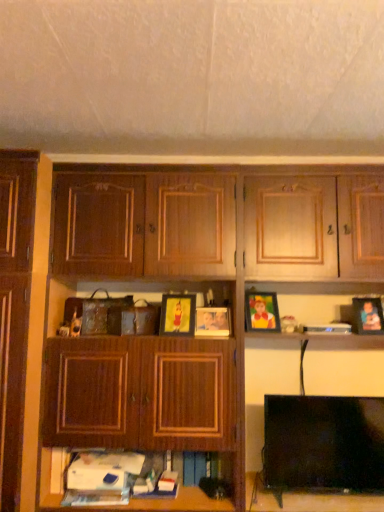
Question: Relative to matte plastic picture frame at center, which is counted as the 2th picture frame, starting from the right, is matte plastic picture frame at right, which is counted as the fourth picture frame, starting from the left, in front or behind?

Choices:
 (A) behind
 (B) front

Answer: (B)

Question: In terms of width, does matte plastic picture frame at right, the first picture frame positioned from the right, look wider or thinner when compared to matte plastic picture frame at center, marked as the third picture frame in a left-to-right arrangement?

Choices:
 (A) wide
 (B) thin

Answer: (B)

Question: Estimate the real-world distances between objects in this image. Which object is closer to the black glossy tv at lower right?

Choices:
 (A) black plastic book at upper right
 (B) matte wooden picture frame at center, acting as the third picture frame starting from the right
 (C) matte plastic picture frame at right, which is counted as the fourth picture frame, starting from the left
 (D) matte wooden picture frame at center, which ranks as the 4th picture frame in right-to-left order
 (E) wooden cabinet at center

Answer: (A)

Question: Based on their relative distances, which object is farther from the black glossy tv at lower right?

Choices:
 (A) wooden cabinet at center
 (B) matte plastic picture frame at center, which is counted as the 2th picture frame, starting from the right
 (C) black plastic book at upper right
 (D) matte wooden picture frame at center, acting as the third picture frame starting from the right
 (E) matte plastic picture frame at right, the first picture frame positioned from the right

Answer: (D)